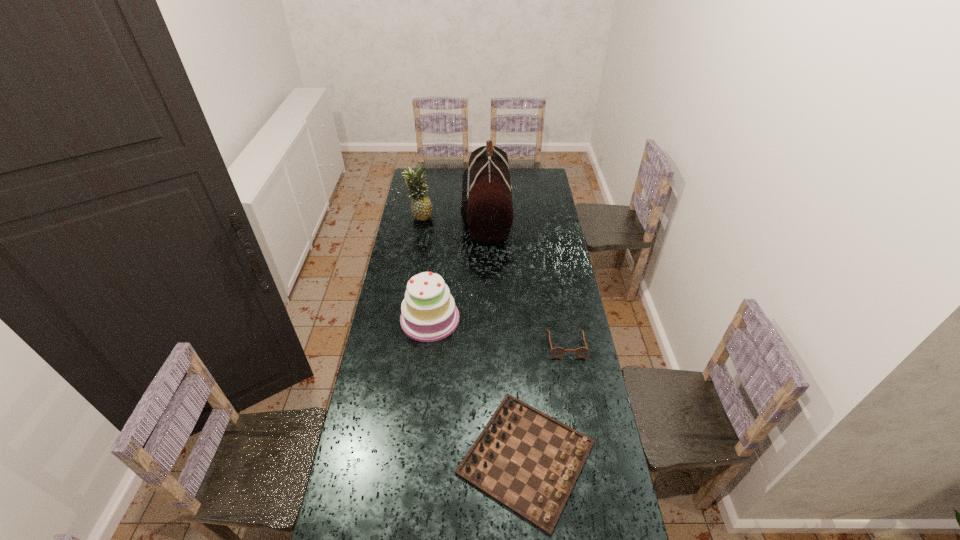
Identify which object is the closest to the cake. Please provide its 2D coordinates. Your answer should be formatted as a tuple, i.e. [(x, y)], where the tuple contains the x and y coordinates of a point satisfying the conditions above.

[(528, 461)]

Locate an element on the screen. The width and height of the screenshot is (960, 540). the second closest object to the duffel bag is located at coordinates (428, 313).

You are a GUI agent. You are given a task and a screenshot of the screen. Output one action in this format:
    pyautogui.click(x=<x>, y=<y>)
    Task: Click on the blank space that satisfies the following two spatial constraints: 1. on the back side of the second shortest object; 2. on the front pocket of the duffel bag
    
    Given the screenshot: What is the action you would take?
    pyautogui.click(x=508, y=214)

Identify the location of vacant space that satisfies the following two spatial constraints: 1. on the front pocket of the tallest object; 2. on the back side of the chessboard. The width and height of the screenshot is (960, 540). [x=491, y=457].